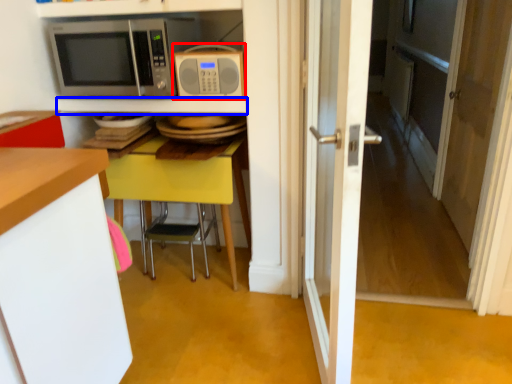
Question: Which point is further to the camera, microwave oven (highlighted by a red box) or shelf (highlighted by a blue box)?

Choices:
 (A) microwave oven
 (B) shelf

Answer: (B)